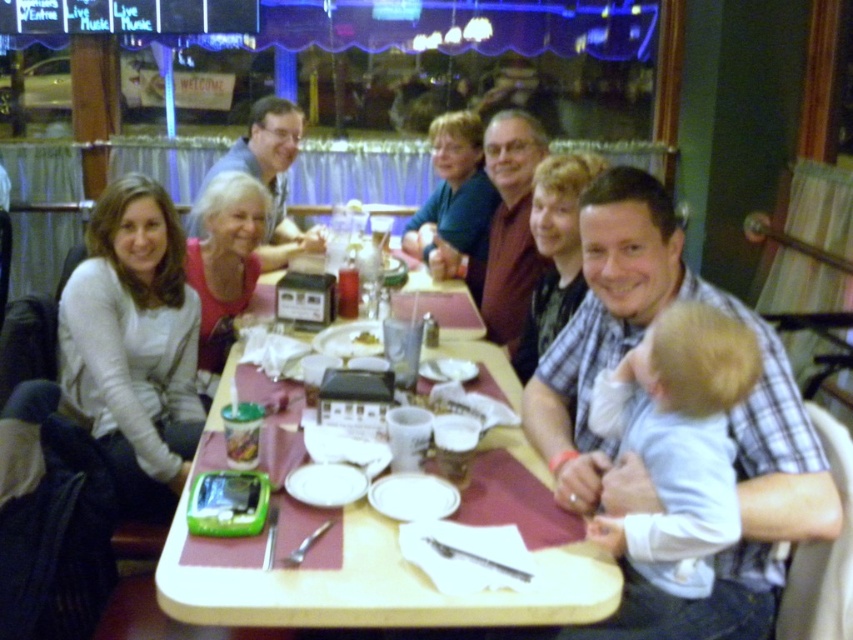
Question: Considering the relative positions of white soft baby at right and white paper napkin at table center in the image provided, where is white soft baby at right located with respect to white paper napkin at table center?

Choices:
 (A) right
 (B) left

Answer: (A)

Question: Which point appears farthest from the camera in this image?

Choices:
 (A) (271, 480)
 (B) (553, 413)

Answer: (B)

Question: Is plaid shirt at center above wooden table at center?

Choices:
 (A) yes
 (B) no

Answer: (A)

Question: Considering the real-world distances, which object is farthest from the white paper napkin at table center?

Choices:
 (A) white soft sweater at left
 (B) wooden table at center
 (C) plaid shirt at center
 (D) white soft baby at right

Answer: (D)

Question: Which point is closer to the camera?

Choices:
 (A) [357, 339]
 (B) [299, 577]
 (C) [170, 358]

Answer: (B)

Question: Can you confirm if plaid shirt at center is bigger than white soft sweater at left?

Choices:
 (A) yes
 (B) no

Answer: (A)